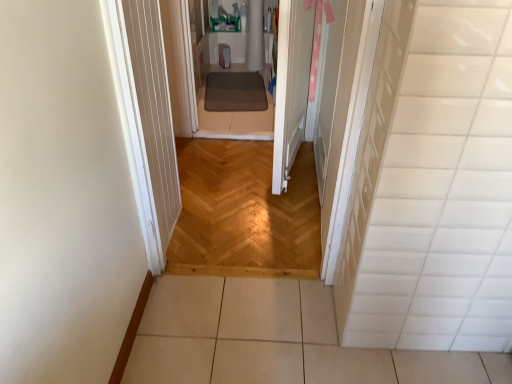
Question: From a real-world perspective, is white wood door at center located higher than natural wood floor at center?

Choices:
 (A) yes
 (B) no

Answer: (A)

Question: From the image's perspective, is white wood door at center on top of natural wood floor at center?

Choices:
 (A) yes
 (B) no

Answer: (A)

Question: Does white wood door at center turn towards natural wood floor at center?

Choices:
 (A) yes
 (B) no

Answer: (A)

Question: Is white wood door at center looking in the opposite direction of natural wood floor at center?

Choices:
 (A) yes
 (B) no

Answer: (B)

Question: Is white wood door at center to the left of natural wood floor at center from the viewer's perspective?

Choices:
 (A) no
 (B) yes

Answer: (A)

Question: Relative to white wood door at center, is brown textured mat at center in front or behind?

Choices:
 (A) behind
 (B) front

Answer: (A)

Question: Based on their positions, is brown textured mat at center located to the left or right of white wood door at center?

Choices:
 (A) left
 (B) right

Answer: (A)

Question: Is brown textured mat at center situated inside white wood door at center or outside?

Choices:
 (A) outside
 (B) inside

Answer: (A)

Question: From the image's perspective, is brown textured mat at center above or below white wood door at center?

Choices:
 (A) above
 (B) below

Answer: (A)

Question: Visually, is white glossy tile at right positioned to the left or to the right of white wood door at center?

Choices:
 (A) left
 (B) right

Answer: (B)

Question: From a real-world perspective, is white glossy tile at right above or below white wood door at center?

Choices:
 (A) below
 (B) above

Answer: (B)

Question: Looking at their shapes, would you say white glossy tile at right is wider or thinner than white wood door at center?

Choices:
 (A) wide
 (B) thin

Answer: (B)

Question: From the image's perspective, is white glossy tile at right positioned above or below white wood door at center?

Choices:
 (A) below
 (B) above

Answer: (A)

Question: Considering their positions, is white glossy tile at right located in front of or behind brown textured mat at center?

Choices:
 (A) behind
 (B) front

Answer: (B)

Question: Looking at their shapes, would you say white glossy tile at right is wider or thinner than brown textured mat at center?

Choices:
 (A) wide
 (B) thin

Answer: (B)